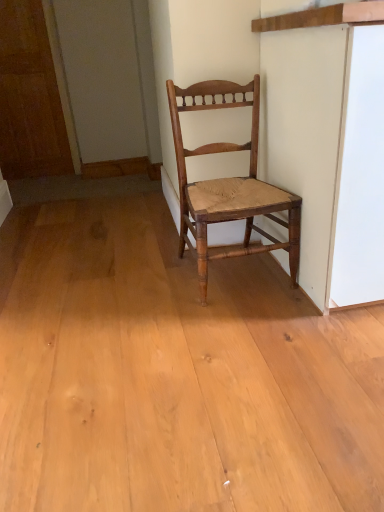
Find the location of a particular element. The image size is (384, 512). free spot in front of natural wood chair at center is located at coordinates pyautogui.click(x=253, y=328).